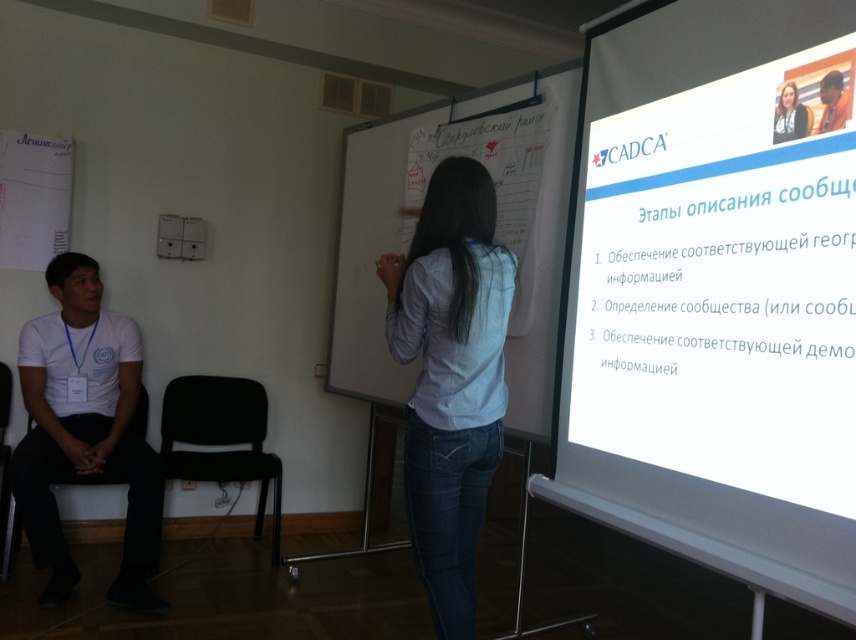
Question: Does light blue denim jeans at center appear on the left side of matte black hair at upper right?

Choices:
 (A) yes
 (B) no

Answer: (A)

Question: Considering the real-world distances, which object is closest to the black plastic chair at left?

Choices:
 (A) white cotton shirt at left
 (B) matte black hair at upper right
 (C) white paper at right
 (D) light blue denim jeans at center

Answer: (A)

Question: Which of the following is the farthest from the observer?

Choices:
 (A) black fabric chair at left
 (B) light blue denim jeans at center

Answer: (A)

Question: Can you confirm if white cotton shirt at left is positioned below black fabric chair at left?

Choices:
 (A) no
 (B) yes

Answer: (A)

Question: Considering the real-world distances, which object is farthest from the white cotton shirt at left?

Choices:
 (A) black plastic chair at lower left
 (B) white paper at right
 (C) matte black hair at upper right
 (D) black plastic chair at left

Answer: (C)

Question: Is black plastic chair at left to the left of matte black hair at upper right from the viewer's perspective?

Choices:
 (A) yes
 (B) no

Answer: (A)